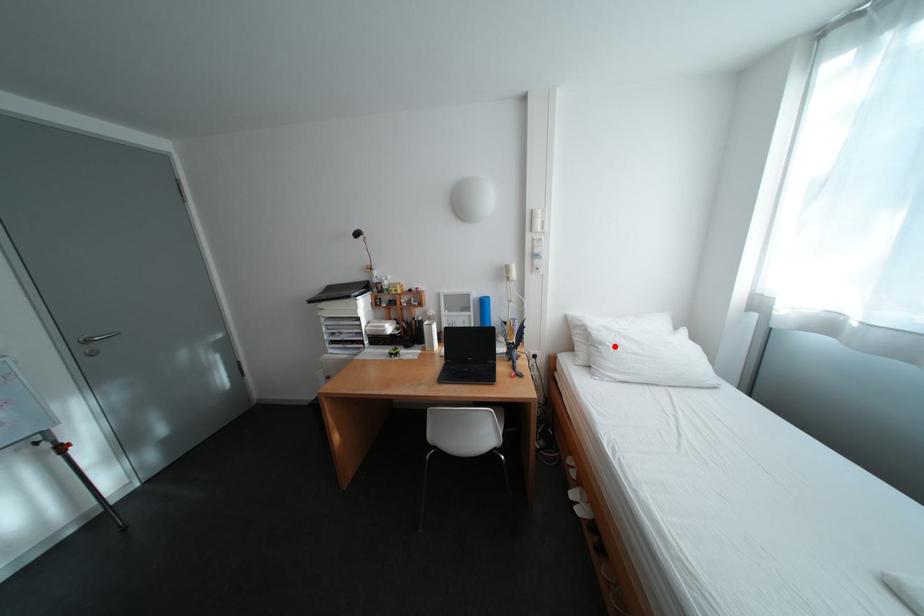
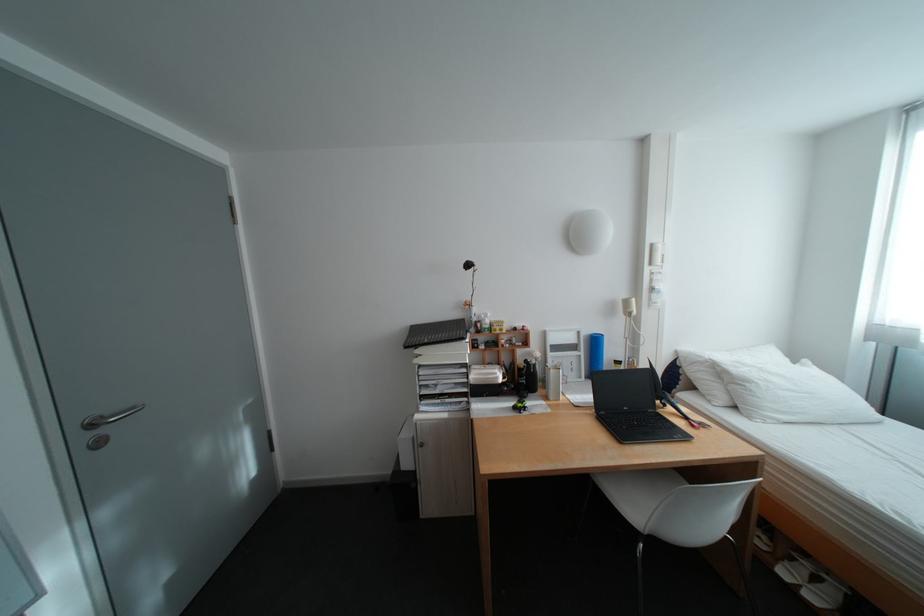
Where in the second image is the point corresponding to the highlighted location from the first image?

(761, 384)